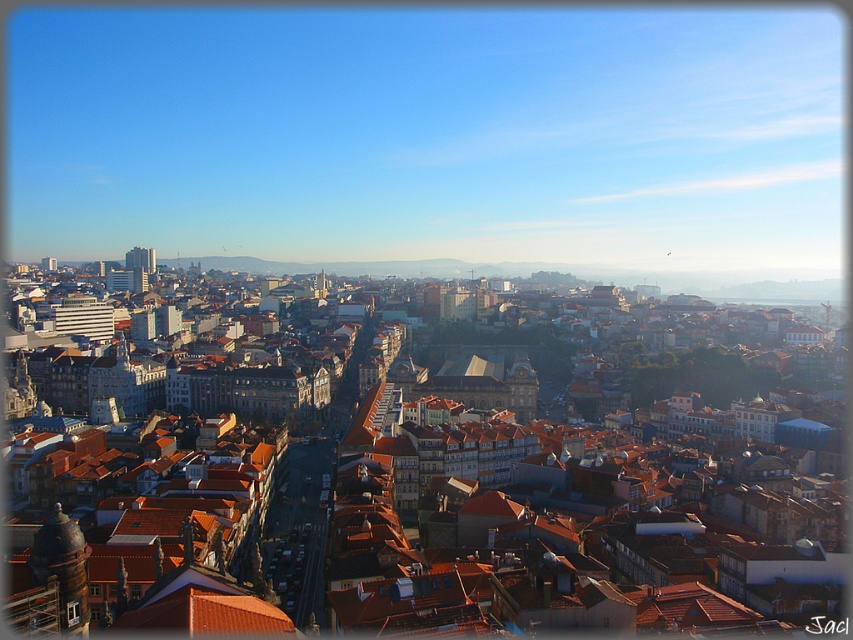
Question: Can you confirm if brown stone tower at lower left is positioned to the right of matte white building at center?

Choices:
 (A) no
 (B) yes

Answer: (B)

Question: Does brown stone tower at lower left lie behind matte white building at center?

Choices:
 (A) no
 (B) yes

Answer: (A)

Question: Which object appears closest to the camera in this image?

Choices:
 (A) matte white building at center
 (B) brown stone tower at lower left

Answer: (B)

Question: Which object appears closest to the camera in this image?

Choices:
 (A) matte white building at center
 (B) brown stone tower at lower left

Answer: (B)

Question: Can you confirm if brown stone tower at lower left is thinner than matte white building at center?

Choices:
 (A) yes
 (B) no

Answer: (B)